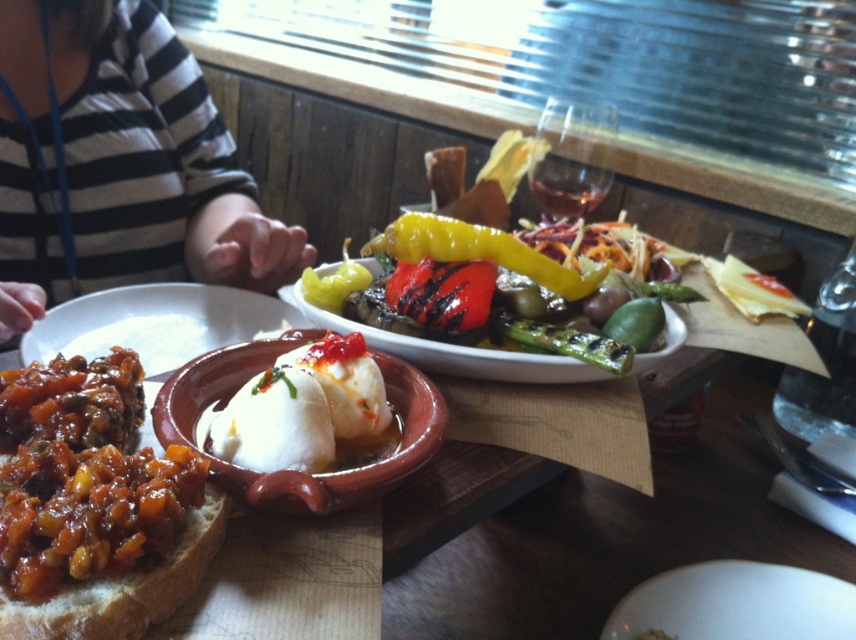
Does striped fabric at upper left have a greater height compared to brown crusty bread at lower left?

Yes.

What do you see at coordinates (122, 161) in the screenshot? The height and width of the screenshot is (640, 856). I see `striped fabric at upper left` at bounding box center [122, 161].

This screenshot has height=640, width=856. In order to click on striped fabric at upper left in this screenshot , I will do `click(122, 161)`.

Describe the element at coordinates (82, 476) in the screenshot. I see `shiny brown bread with chili topping at lower left` at that location.

Which is behind, point (3, 532) or point (51, 604)?

The point (3, 532) is behind.

What do you see at coordinates (82, 476) in the screenshot? I see `shiny brown bread with chili topping at lower left` at bounding box center [82, 476].

The image size is (856, 640). Identify the location of shiny brown bread with chili topping at lower left. (82, 476).

Who is positioned more to the left, shiny brown bread with chili topping at lower left or glossy yellow pepper at center?

From the viewer's perspective, shiny brown bread with chili topping at lower left appears more on the left side.

Does point (88, 364) come in front of point (470, 248)?

Yes, it is.

Is point (40, 433) positioned after point (474, 228)?

No, (40, 433) is in front of (474, 228).

Where is `shiny brown bread with chili topping at lower left`? This screenshot has width=856, height=640. shiny brown bread with chili topping at lower left is located at coordinates (82, 476).